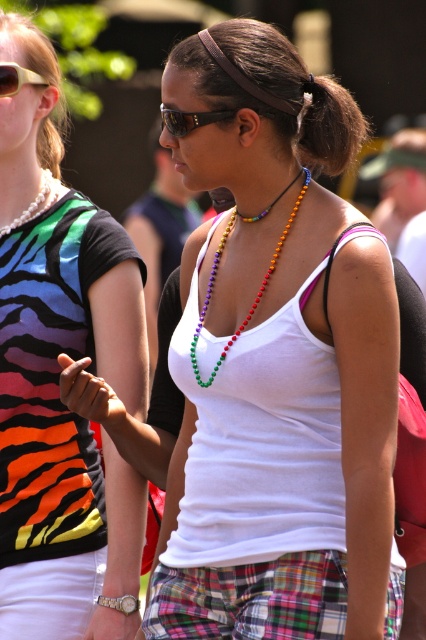
Question: Does plaid fabric kilt at center have a smaller size compared to multicolored beads necklace at center?

Choices:
 (A) yes
 (B) no

Answer: (B)

Question: Which object is positioned farthest from the matte black sunglasses at upper left?

Choices:
 (A) white matte tank top at center
 (B) multicolored beads necklace at center
 (C) pearl necklace at upper left

Answer: (B)

Question: Observing the image, what is the correct spatial positioning of white matte tank top at center in reference to pearl necklace at upper left?

Choices:
 (A) above
 (B) below

Answer: (B)

Question: Among these objects, which one is farthest from the camera?

Choices:
 (A) multicolored beads necklace at center
 (B) pearl necklace at upper left
 (C) white matte tank top at center

Answer: (B)

Question: Among these objects, which one is nearest to the camera?

Choices:
 (A) pearl necklace at upper left
 (B) multicolored beads necklace at center
 (C) plaid fabric kilt at center

Answer: (C)

Question: Does multicolored beads necklace at center appear under matte black sunglasses at upper left?

Choices:
 (A) no
 (B) yes

Answer: (B)